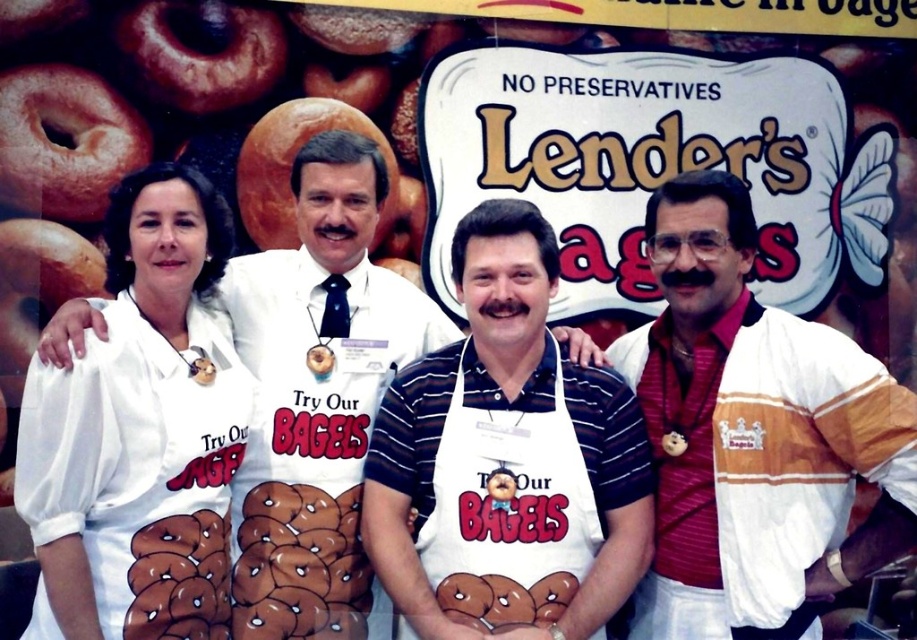
Which is above, white striped jacket at right or white fabric apron at left?

white fabric apron at left

This screenshot has width=917, height=640. Find the location of `white striped jacket at right`. white striped jacket at right is located at coordinates (753, 429).

Who is shorter, white fabric apron at left or white apron with printed design at center?

white apron with printed design at center is shorter.

Between white fabric apron at left and white apron with printed design at center, which one appears on the left side from the viewer's perspective?

Positioned to the left is white fabric apron at left.

Is point (130, 593) positioned in front of point (436, 364)?

Yes, point (130, 593) is in front of point (436, 364).

Identify the location of white fabric apron at left. (139, 433).

Is white apron with printed design at center positioned at the back of white apron with printed bagels at center?

No, it is not.

Who is higher up, white apron with printed design at center or white apron with printed bagels at center?

Positioned higher is white apron with printed bagels at center.

Which is in front, point (587, 467) or point (319, 570)?

Point (587, 467)

The image size is (917, 640). Identify the location of white apron with printed design at center. (509, 460).